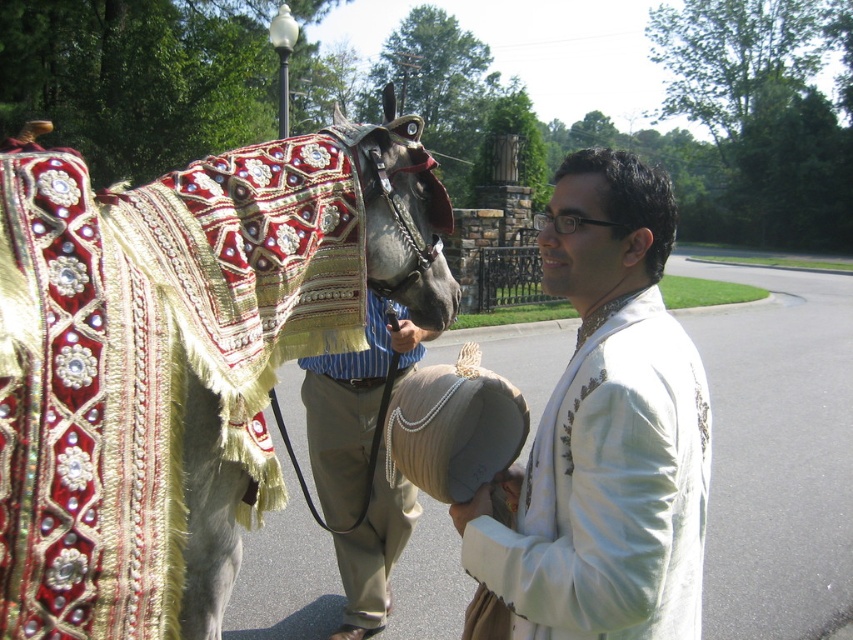
Question: Is white embroidered shirt at center closer to the viewer compared to striped fabric pants at center?

Choices:
 (A) yes
 (B) no

Answer: (A)

Question: Which point is closer to the camera?

Choices:
 (A) (383, 561)
 (B) (351, 337)

Answer: (B)

Question: Estimate the real-world distances between objects in this image. Which object is closer to the white embroidered shirt at center?

Choices:
 (A) striped fabric pants at center
 (B) shiny gold blanket at left

Answer: (B)

Question: Is white embroidered shirt at center below striped fabric pants at center?

Choices:
 (A) no
 (B) yes

Answer: (A)

Question: Is shiny gold blanket at left below striped fabric pants at center?

Choices:
 (A) yes
 (B) no

Answer: (B)

Question: Which object is positioned closest to the striped fabric pants at center?

Choices:
 (A) white embroidered shirt at center
 (B) shiny gold blanket at left

Answer: (B)